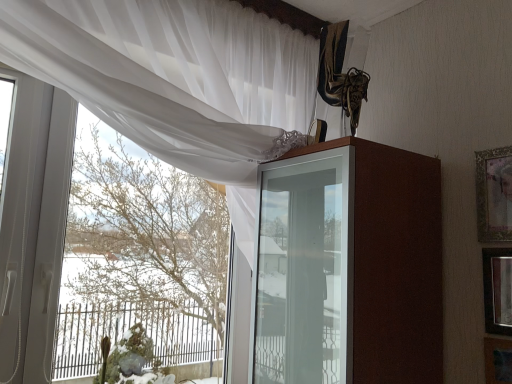
Question: From the image's perspective, is brown glossy cabinet at upper center above green mossy plant at lower left?

Choices:
 (A) no
 (B) yes

Answer: (B)

Question: Is brown glossy cabinet at upper center with green mossy plant at lower left?

Choices:
 (A) yes
 (B) no

Answer: (B)

Question: Considering the relative sizes of brown glossy cabinet at upper center and green mossy plant at lower left in the image provided, is brown glossy cabinet at upper center shorter than green mossy plant at lower left?

Choices:
 (A) yes
 (B) no

Answer: (B)

Question: Is brown glossy cabinet at upper center oriented away from green mossy plant at lower left?

Choices:
 (A) no
 (B) yes

Answer: (A)

Question: Is brown glossy cabinet at upper center positioned beyond the bounds of green mossy plant at lower left?

Choices:
 (A) no
 (B) yes

Answer: (B)

Question: From the image's perspective, is white sheer curtain at upper left positioned above or below green mossy plant at lower left?

Choices:
 (A) above
 (B) below

Answer: (A)

Question: Is white sheer curtain at upper left taller or shorter than green mossy plant at lower left?

Choices:
 (A) tall
 (B) short

Answer: (A)

Question: Considering their positions, is white sheer curtain at upper left located in front of or behind green mossy plant at lower left?

Choices:
 (A) front
 (B) behind

Answer: (A)

Question: Is white sheer curtain at upper left situated inside green mossy plant at lower left or outside?

Choices:
 (A) inside
 (B) outside

Answer: (B)

Question: Is brown glossy cabinet at upper center in front of or behind wooden framed mirror at right, the second picture frame positioned from the bottom, in the image?

Choices:
 (A) front
 (B) behind

Answer: (A)

Question: Considering the positions of point (305, 347) and point (502, 279), is point (305, 347) closer or farther from the camera than point (502, 279)?

Choices:
 (A) farther
 (B) closer

Answer: (B)

Question: Considering the positions of brown glossy cabinet at upper center and wooden framed mirror at right, the 2th picture frame viewed from the top, in the image, is brown glossy cabinet at upper center taller or shorter than wooden framed mirror at right, the 2th picture frame viewed from the top,?

Choices:
 (A) tall
 (B) short

Answer: (A)

Question: Is brown glossy cabinet at upper center bigger or smaller than wooden framed mirror at right, the second picture frame positioned from the bottom?

Choices:
 (A) big
 (B) small

Answer: (A)

Question: Which is correct: brown glossy cabinet at upper center is inside wooden picture frame at lower right, arranged as the 1th picture frame when ordered from the bottom, or outside of it?

Choices:
 (A) inside
 (B) outside

Answer: (B)

Question: Based on their sizes in the image, would you say brown glossy cabinet at upper center is bigger or smaller than wooden picture frame at lower right, the 3th picture frame positioned from the top?

Choices:
 (A) big
 (B) small

Answer: (A)